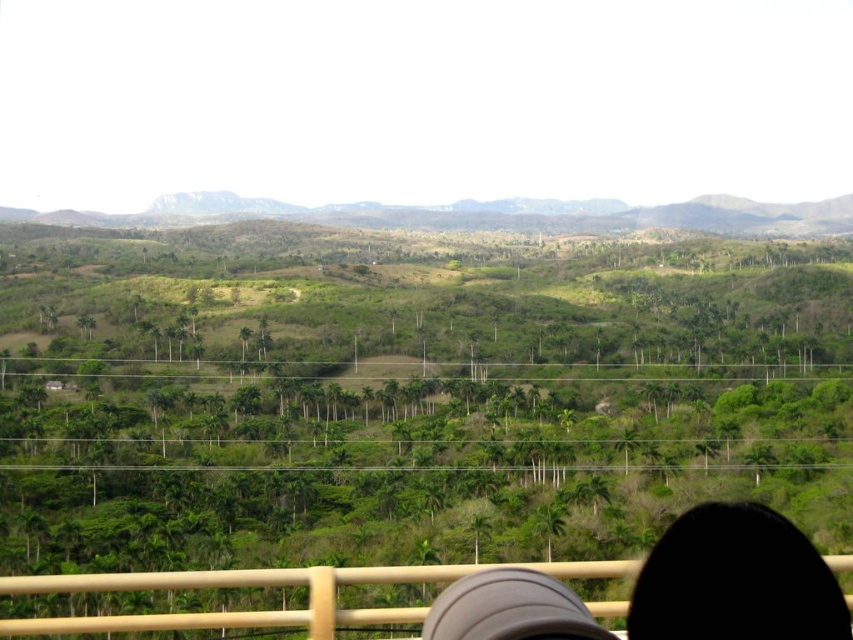
Between black hair at lower right and wooden rail at bottom, which one is positioned higher?

black hair at lower right

I want to click on black hair at lower right, so click(735, 580).

Is point (714, 605) positioned in front of point (461, 224)?

Yes, point (714, 605) is closer to viewer.

Does black hair at lower right appear over green grassy hillside at upper center?

No, black hair at lower right is not above green grassy hillside at upper center.

Find the location of `black hair at lower right`. black hair at lower right is located at coordinates (735, 580).

Find the location of a particular element. This screenshot has height=640, width=853. black hair at lower right is located at coordinates [x=735, y=580].

Is point (91, 225) farther from camera compared to point (198, 579)?

Yes, it is behind point (198, 579).

Can you confirm if green grassy hillside at upper center is taller than wooden rail at bottom?

No.

Who is more distant from viewer, (560, 205) or (415, 614)?

The point (560, 205) is behind.

Where is `green grassy hillside at upper center`? green grassy hillside at upper center is located at coordinates (482, 214).